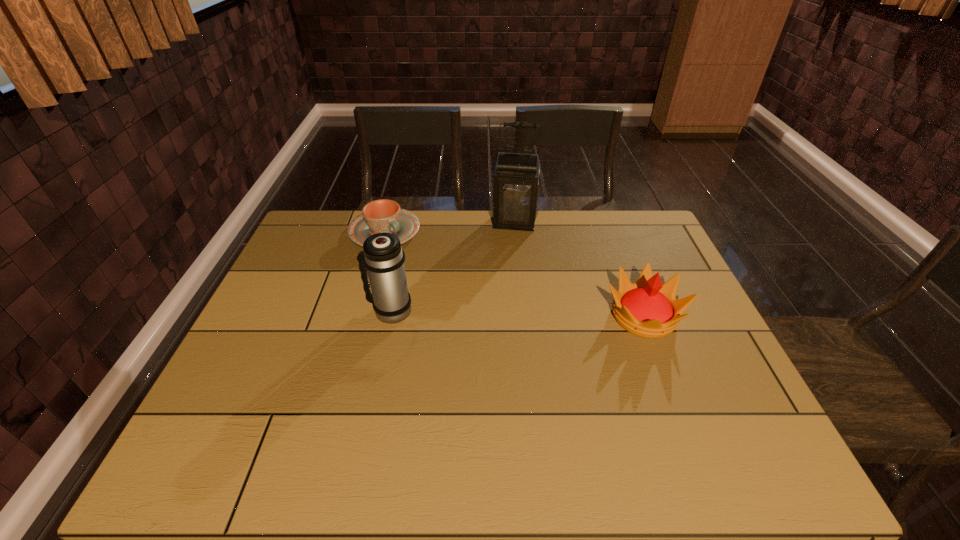
Where is `object that is at the far left corner`? object that is at the far left corner is located at coordinates (380, 216).

Image resolution: width=960 pixels, height=540 pixels. I want to click on free space at the far edge, so click(563, 216).

Locate an element on the screen. This screenshot has height=540, width=960. free space at the left edge of the desktop is located at coordinates (269, 309).

At what (x,y) coordinates should I click in order to perform the action: click on blank space at the right edge of the desktop. Please return your answer as a coordinate pair (x, y). The image size is (960, 540). Looking at the image, I should click on (683, 334).

The height and width of the screenshot is (540, 960). What are the coordinates of `blank space at the far left corner of the desktop` in the screenshot? It's located at (313, 234).

At what (x,y) coordinates should I click in order to perform the action: click on vacant space at the near left corner of the desktop. Please return your answer as a coordinate pair (x, y). Looking at the image, I should click on pos(288,392).

Where is `free space at the far right corner of the desktop`? free space at the far right corner of the desktop is located at coordinates (631, 232).

I want to click on free region at the near right corner, so click(x=710, y=398).

I want to click on unoccupied area between the chinaware and the third object from left to right, so click(x=449, y=227).

I want to click on free point between the lantern and the shortest object, so click(449, 227).